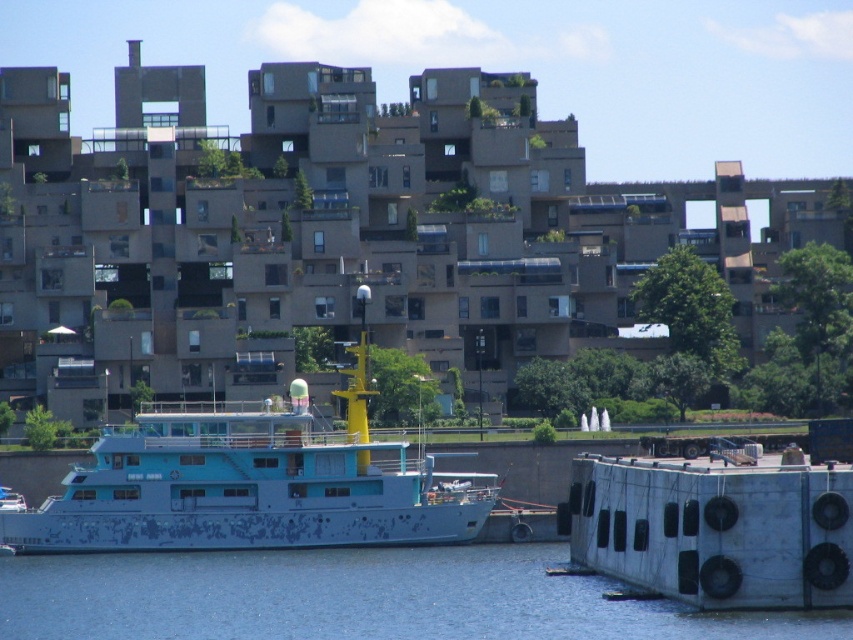
You are standing in front of the building and notice two points marked on the image. The first point is at coordinate point(210,592) and the second is at point(227,524). Which point is closer to you?

Point(210,592) is closer to the camera than point(227,524).

You are standing on the dock and looking out at the scene. Which object is closer to you, the blue water at lower center or the blue faded paint boat at center?

The blue water at lower center is closer to you because it is in front of the blue faded paint boat at center.

You are standing at the point marked by the coordinates point (355, 598) in the image. Based on the scene description, what would you most likely see around you?

You would most likely see blue water at lower center around you, as the coordinates point (355, 598) indicates that location.